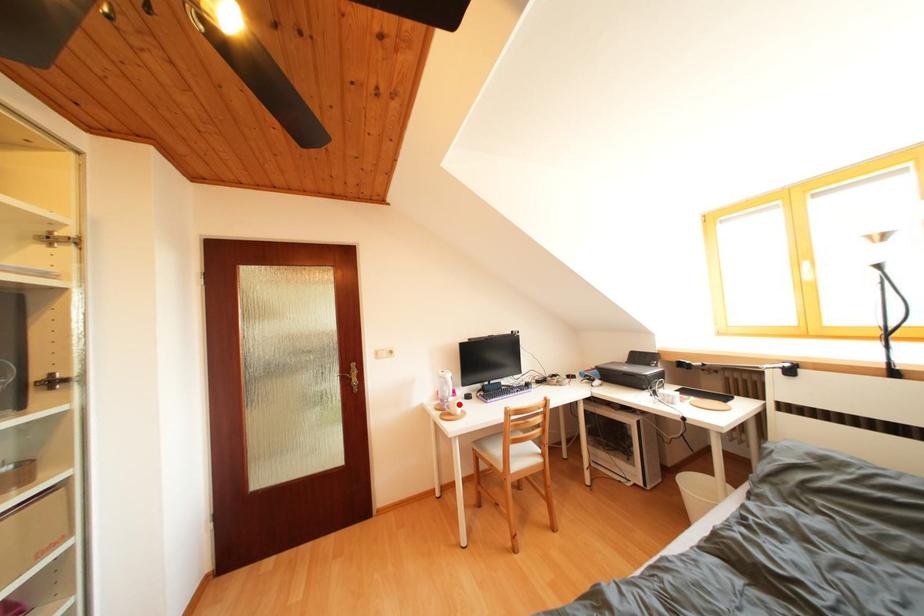
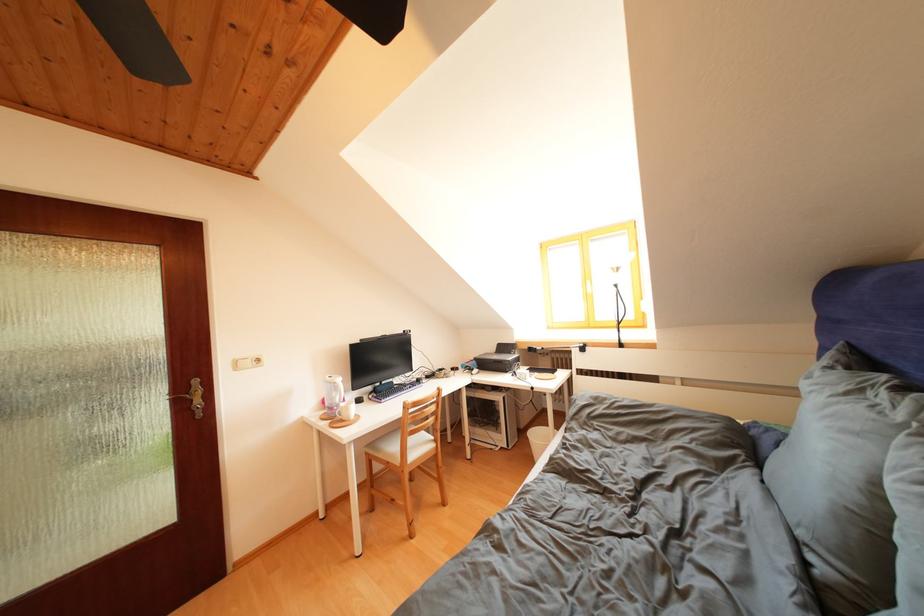
Find the pixel in the second image that matches the highlighted location in the first image.

(350, 410)